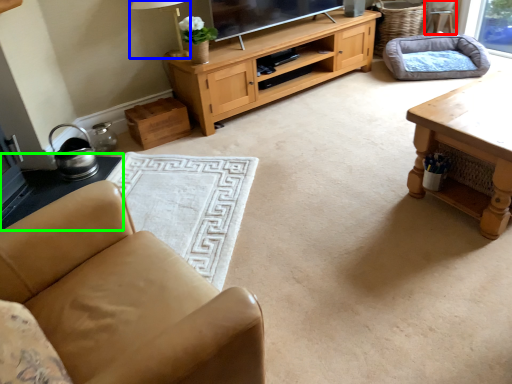
Question: Based on their relative distances, which object is nearer to armchair (highlighted by a red box)? Choose from lamp (highlighted by a blue box) and side table (highlighted by a green box).

Choices:
 (A) lamp
 (B) side table

Answer: (A)